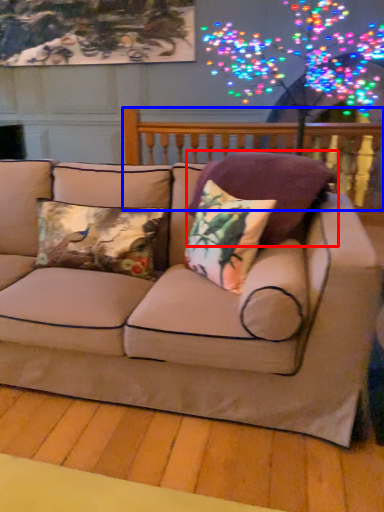
Question: Which object is further to the camera taking this photo, pillow (highlighted by a red box) or balustrade (highlighted by a blue box)?

Choices:
 (A) pillow
 (B) balustrade

Answer: (B)